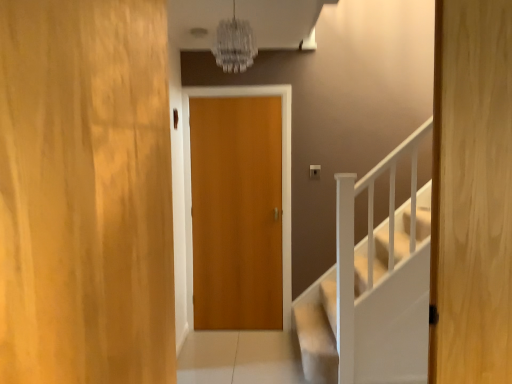
Describe the element at coordinates (85, 193) in the screenshot. I see `wooden door at center, positioned as the 1th door in front-to-back order` at that location.

What is the approximate height of wooden door at center, positioned as the 1th door in front-to-back order?

The height of wooden door at center, positioned as the 1th door in front-to-back order, is 3.59 feet.

Where is `wooden door at center, the third door from the front`? wooden door at center, the third door from the front is located at coordinates (236, 212).

Where is `wooden door at center, positioned as the 1th door in front-to-back order`? wooden door at center, positioned as the 1th door in front-to-back order is located at coordinates (85, 193).

Which of these two, wooden door at center, which is the 1th door from right to left, or wooden door at center, which is the third door in right-to-left order, is wider?

With larger width is wooden door at center, which is the third door in right-to-left order.

Consider the image. Does wooden door at center, the second door in the front-to-back sequence, turn towards wooden door at center, arranged as the 1th door when viewed from the left?

No, wooden door at center, the second door in the front-to-back sequence, is not turned towards wooden door at center, arranged as the 1th door when viewed from the left.

Is wooden door at center, the 3th door in the left-to-right sequence, not within wooden door at center, which is the third door in right-to-left order?

wooden door at center, the 3th door in the left-to-right sequence, lies outside wooden door at center, which is the third door in right-to-left order,'s area.

Can you confirm if wooden door at center, positioned as the 1th door in front-to-back order, is positioned to the right of wooden door at center, the second door viewed from the back?

No.

From a real-world perspective, is wooden door at center, which is the third door in right-to-left order, positioned above or below wooden door at center, the 3th door in the left-to-right sequence?

wooden door at center, which is the third door in right-to-left order, is situated higher than wooden door at center, the 3th door in the left-to-right sequence, in the real world.

Can you confirm if wooden door at center, marked as the 3th door in a back-to-front arrangement, is bigger than wooden door at center, the 3th door in the left-to-right sequence?

Yes.

Would you say wooden door at center, marked as the 3th door in a back-to-front arrangement, is inside or outside wooden door at center, which is the 1th door from right to left?

wooden door at center, marked as the 3th door in a back-to-front arrangement, exists outside the volume of wooden door at center, which is the 1th door from right to left.

This screenshot has width=512, height=384. What are the coordinates of `door below the wooden door at center, marked as the 3th door in a back-to-front arrangement (from the image's perspective)` in the screenshot? It's located at (236, 212).

From a real-world perspective, between wooden door at center, the second door in the right-to-left sequence, and wooden door at center, arranged as the 1th door when viewed from the left, who is vertically higher?

wooden door at center, arranged as the 1th door when viewed from the left, is physically above.

Considering the relative sizes of wooden door at center, marked as the 2th door in a left-to-right arrangement, and wooden door at center, which is the third door in right-to-left order, in the image provided, is wooden door at center, marked as the 2th door in a left-to-right arrangement, taller than wooden door at center, which is the third door in right-to-left order,?

Indeed, wooden door at center, marked as the 2th door in a left-to-right arrangement, has a greater height compared to wooden door at center, which is the third door in right-to-left order.

Would you say wooden door at center, marked as the 2th door in a left-to-right arrangement, is outside wooden door at center, positioned as the 1th door in front-to-back order?

Yes, wooden door at center, marked as the 2th door in a left-to-right arrangement, is not within wooden door at center, positioned as the 1th door in front-to-back order.

Does point (475, 302) come closer to viewer compared to point (220, 121)?

Yes, it is.

From a real-world perspective, who is located higher, wooden door at center, the second door in the front-to-back sequence, or wooden door at center, which is the first door in back-to-front order?

From a 3D spatial view, wooden door at center, the second door in the front-to-back sequence, is above.

In the scene shown: Are wooden door at center, the second door viewed from the back, and wooden door at center, the second door in the right-to-left sequence, making contact?

wooden door at center, the second door viewed from the back, is not next to wooden door at center, the second door in the right-to-left sequence, and they're not touching.

How much distance is there between wooden door at center, the second door viewed from the back, and wooden door at center, the third door from the front?

8.01 feet.

Who is more distant, wooden door at center, arranged as the 1th door when viewed from the left, or wooden door at center, which is the first door in back-to-front order?

wooden door at center, which is the first door in back-to-front order, is behind.

Which of these two, wooden door at center, which is the third door in right-to-left order, or wooden door at center, the second door in the right-to-left sequence, is thinner?

Thinner between the two is wooden door at center, the second door in the right-to-left sequence.

Could you tell me if wooden door at center, marked as the 3th door in a back-to-front arrangement, is turned towards wooden door at center, which is the first door in back-to-front order?

No, wooden door at center, marked as the 3th door in a back-to-front arrangement, does not turn towards wooden door at center, which is the first door in back-to-front order.

Is point (39, 29) positioned in front of point (267, 251)?

Yes, it is.

From the image's perspective, which one is positioned higher, wooden door at center, the second door in the right-to-left sequence, or wooden door at center, which is the 1th door from right to left?

wooden door at center, which is the 1th door from right to left.

Could wooden door at center, the 3th door in the left-to-right sequence, be considered to be inside wooden door at center, which is the first door in back-to-front order?

No, wooden door at center, the 3th door in the left-to-right sequence, is not inside wooden door at center, which is the first door in back-to-front order.

Is wooden door at center, which is the first door in back-to-front order, positioned behind wooden door at center, which is the 1th door from right to left?

Yes, wooden door at center, which is the first door in back-to-front order, is further from the camera.

Which of these two, wooden door at center, the third door from the front, or wooden door at center, the 3th door in the left-to-right sequence, is bigger?

Bigger between the two is wooden door at center, the third door from the front.

Identify the location of the 1st door below the wooden door at center, marked as the 3th door in a back-to-front arrangement (from a real-world perspective). The height and width of the screenshot is (384, 512). (472, 193).

You are a GUI agent. You are given a task and a screenshot of the screen. Output one action in this format:
    pyautogui.click(x=<x>, y=<y>)
    Task: Click on the door that appears above the wooden door at center, the second door viewed from the back (from a real-world perspective)
    Image resolution: width=512 pixels, height=384 pixels.
    Given the screenshot: What is the action you would take?
    pyautogui.click(x=85, y=193)

Based on their spatial positions, is wooden door at center, which is the 1th door from right to left, or wooden door at center, the third door from the front, closer to wooden door at center, marked as the 3th door in a back-to-front arrangement?

wooden door at center, which is the 1th door from right to left.

Estimate the real-world distances between objects in this image. Which object is closer to wooden door at center, which is the first door in back-to-front order, wooden door at center, arranged as the 1th door when viewed from the left, or wooden door at center, the second door in the front-to-back sequence?

wooden door at center, the second door in the front-to-back sequence, lies closer to wooden door at center, which is the first door in back-to-front order, than the other object.

Looking at the image, which one is located further to wooden door at center, which is the third door in right-to-left order, wooden door at center, the third door from the front, or wooden door at center, the second door in the front-to-back sequence?

Based on the image, wooden door at center, the third door from the front, appears to be further to wooden door at center, which is the third door in right-to-left order.

When comparing their distances from wooden door at center, the second door in the front-to-back sequence, does wooden door at center, marked as the 2th door in a left-to-right arrangement, or wooden door at center, positioned as the 1th door in front-to-back order, seem further?

Among the two, wooden door at center, marked as the 2th door in a left-to-right arrangement, is located further to wooden door at center, the second door in the front-to-back sequence.

Which object lies nearer to the anchor point wooden door at center, the second door in the right-to-left sequence, wooden door at center, which is the 1th door from right to left, or wooden door at center, marked as the 3th door in a back-to-front arrangement?

wooden door at center, which is the 1th door from right to left.

Looking at the image, which one is located closer to wooden door at center, the second door viewed from the back, wooden door at center, which is the third door in right-to-left order, or wooden door at center, the third door from the front?

The object closer to wooden door at center, the second door viewed from the back, is wooden door at center, which is the third door in right-to-left order.

The height and width of the screenshot is (384, 512). Identify the location of door located between wooden door at center, marked as the 3th door in a back-to-front arrangement, and wooden door at center, which is the first door in back-to-front order, in the depth direction. (472, 193).